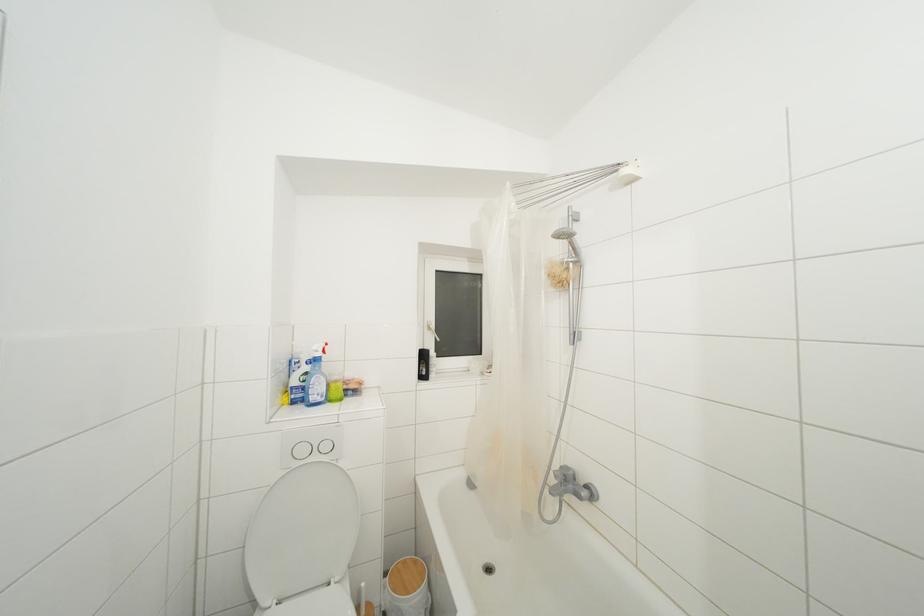
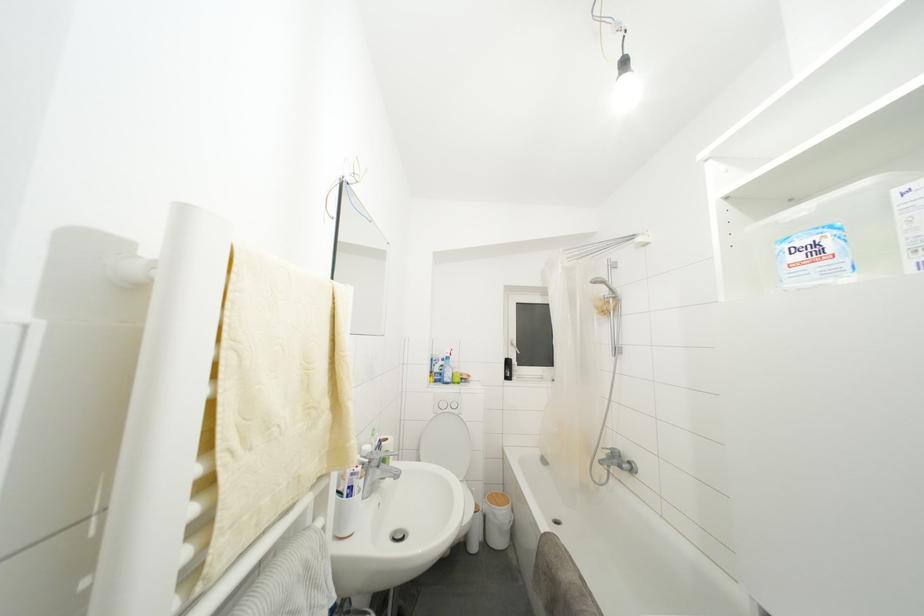
Question: How did the camera likely rotate?

Choices:
 (A) Left
 (B) Right
 (C) Up
 (D) Down

Answer: (A)